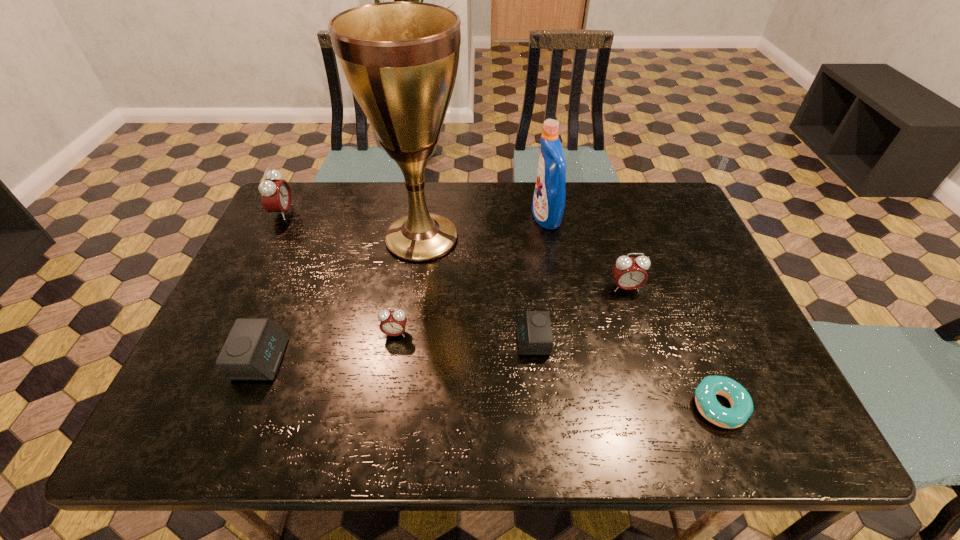
At what (x,y) coordinates should I click in order to perform the action: click on alarm clock at the far edge. Please return your answer as a coordinate pair (x, y). The width and height of the screenshot is (960, 540). Looking at the image, I should click on (276, 196).

Identify the location of object at the near edge. The image size is (960, 540). (740, 400).

Identify the location of object located at the right edge. (740, 400).

Locate an element on the screen. The width and height of the screenshot is (960, 540). object that is at the far left corner is located at coordinates (276, 196).

You are a GUI agent. You are given a task and a screenshot of the screen. Output one action in this format:
    pyautogui.click(x=<x>, y=<y>)
    Task: Click on the object that is at the near right corner
    This screenshot has height=540, width=960.
    Given the screenshot: What is the action you would take?
    pyautogui.click(x=740, y=400)

At what (x,y) coordinates should I click in order to perform the action: click on blank space at the far edge of the desktop. Please return your answer as a coordinate pair (x, y). Image resolution: width=960 pixels, height=540 pixels. Looking at the image, I should click on (512, 184).

What are the coordinates of `vacant point at the right edge` in the screenshot? It's located at (717, 298).

This screenshot has width=960, height=540. Find the location of `free space at the far left corner`. free space at the far left corner is located at coordinates (296, 213).

In the image, there is a desktop. Where is `free space at the near right corner`? This screenshot has height=540, width=960. free space at the near right corner is located at coordinates (785, 444).

Image resolution: width=960 pixels, height=540 pixels. Find the location of `free space between the second alarm clock from right to left and the second nearest pink alarm clock`. free space between the second alarm clock from right to left and the second nearest pink alarm clock is located at coordinates (579, 314).